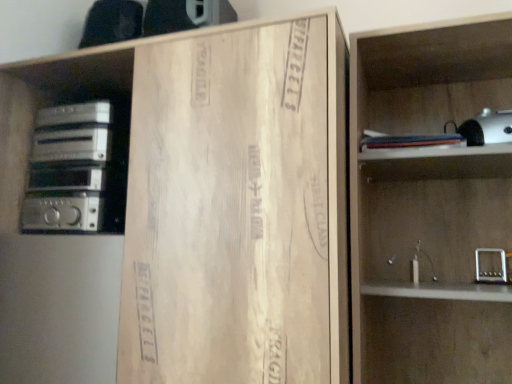
Question: Considering the relative sizes of silver metallic stereo at left and wooden shelf at right in the image provided, is silver metallic stereo at left shorter than wooden shelf at right?

Choices:
 (A) yes
 (B) no

Answer: (A)

Question: Considering the relative sizes of silver metallic stereo at left and wooden shelf at right in the image provided, is silver metallic stereo at left wider than wooden shelf at right?

Choices:
 (A) no
 (B) yes

Answer: (A)

Question: Is silver metallic stereo at left to the left of wooden shelf at right from the viewer's perspective?

Choices:
 (A) yes
 (B) no

Answer: (A)

Question: From a real-world perspective, is silver metallic stereo at left physically below wooden shelf at right?

Choices:
 (A) no
 (B) yes

Answer: (A)

Question: Is silver metallic stereo at left oriented away from wooden shelf at right?

Choices:
 (A) yes
 (B) no

Answer: (B)

Question: In terms of height, does wooden shelf at right look taller or shorter compared to silver metallic stereo at left?

Choices:
 (A) tall
 (B) short

Answer: (A)

Question: Visually, is wooden shelf at right positioned to the left or to the right of silver metallic stereo at left?

Choices:
 (A) right
 (B) left

Answer: (A)

Question: Looking at the image, does wooden shelf at right seem bigger or smaller compared to silver metallic stereo at left?

Choices:
 (A) big
 (B) small

Answer: (A)

Question: From the image's perspective, relative to silver metallic stereo at left, is wooden shelf at right above or below?

Choices:
 (A) below
 (B) above

Answer: (A)

Question: Would you say silver metallic stereo at left is inside or outside wooden cardboard at center?

Choices:
 (A) outside
 (B) inside

Answer: (B)

Question: Considering their positions, is silver metallic stereo at left located in front of or behind wooden cardboard at center?

Choices:
 (A) front
 (B) behind

Answer: (B)

Question: In the image, is silver metallic stereo at left on the left side or the right side of wooden cardboard at center?

Choices:
 (A) left
 (B) right

Answer: (A)

Question: From a real-world perspective, is silver metallic stereo at left physically located above or below wooden cardboard at center?

Choices:
 (A) above
 (B) below

Answer: (A)

Question: Considering the positions of point (161, 220) and point (80, 163), is point (161, 220) closer or farther from the camera than point (80, 163)?

Choices:
 (A) farther
 (B) closer

Answer: (B)

Question: From their relative heights in the image, would you say wooden cardboard at center is taller or shorter than silver metallic stereo at left?

Choices:
 (A) tall
 (B) short

Answer: (A)